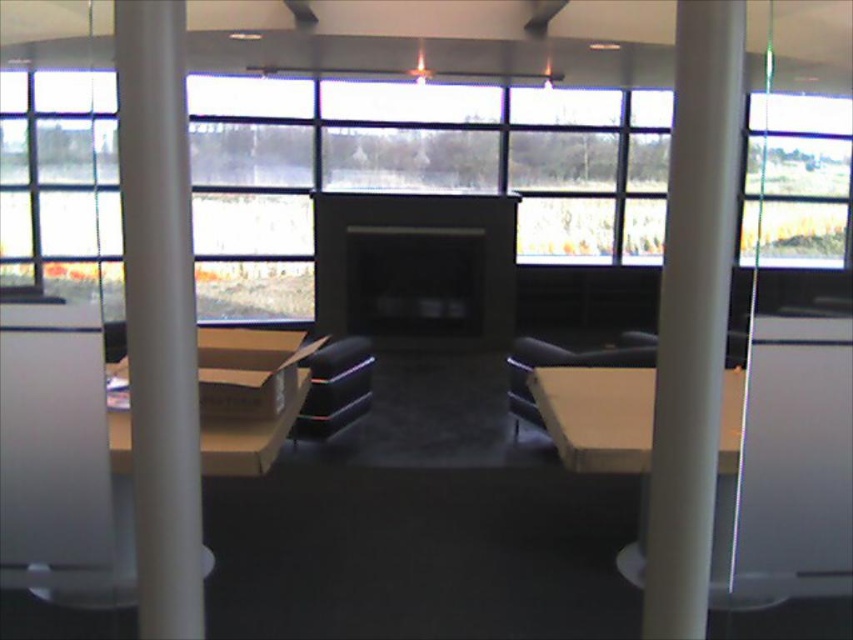
Question: Does white smooth pillar at center appear on the left side of black leather chair at center?

Choices:
 (A) yes
 (B) no

Answer: (B)

Question: Does transparent glass window at upper right appear under matte cardboard table at lower left?

Choices:
 (A) no
 (B) yes

Answer: (A)

Question: Which object appears closest to the camera in this image?

Choices:
 (A) matte black chair at center
 (B) white glossy pillar at left

Answer: (B)

Question: Does black leather chair at center appear over matte black chair at center?

Choices:
 (A) yes
 (B) no

Answer: (B)

Question: Based on their relative distances, which object is farther from the transparent glass window at upper right?

Choices:
 (A) transparent glass window at upper center
 (B) matte brown table at center
 (C) white glossy pillar at left

Answer: (C)

Question: Among these points, which one is nearest to the camera?

Choices:
 (A) (541, 412)
 (B) (668, 538)
 (C) (265, 461)
 (D) (552, 141)

Answer: (B)